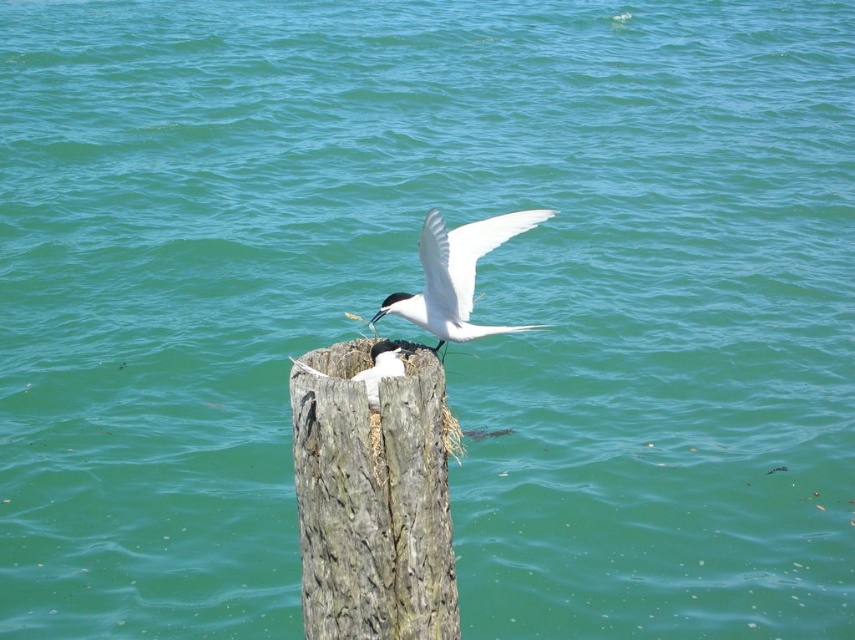
Who is shorter, weathered wood stump at center or white glossy bird at center?

Standing shorter between the two is white glossy bird at center.

The width and height of the screenshot is (855, 640). In order to click on weathered wood stump at center in this screenshot , I will do `click(372, 500)`.

The width and height of the screenshot is (855, 640). I want to click on weathered wood stump at center, so click(x=372, y=500).